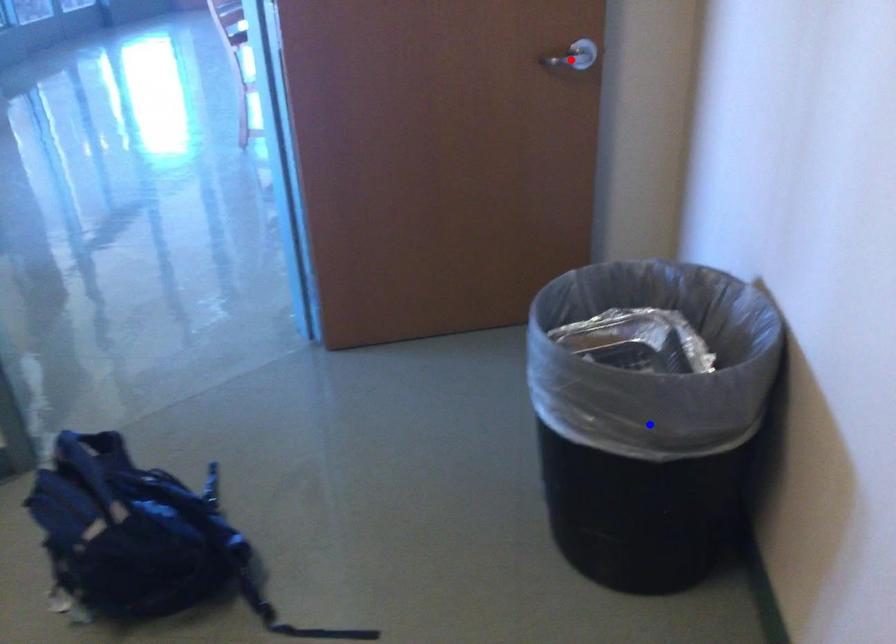
Question: Two points are marked on the image. Which point is closer to the camera?

Choices:
 (A) Blue point is closer.
 (B) Red point is closer.

Answer: (A)